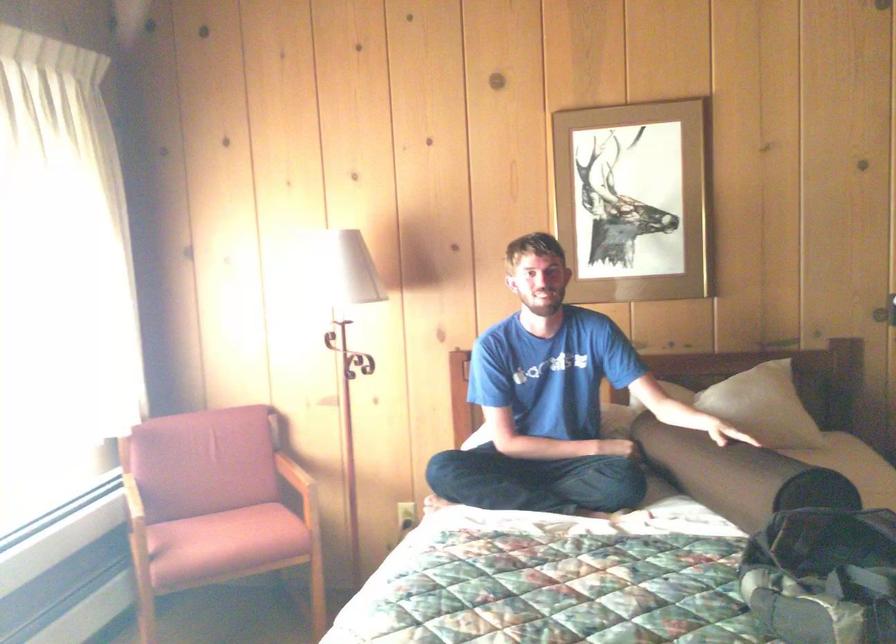
Which object does [737,475] point to?

It refers to a brown bolster pillow.